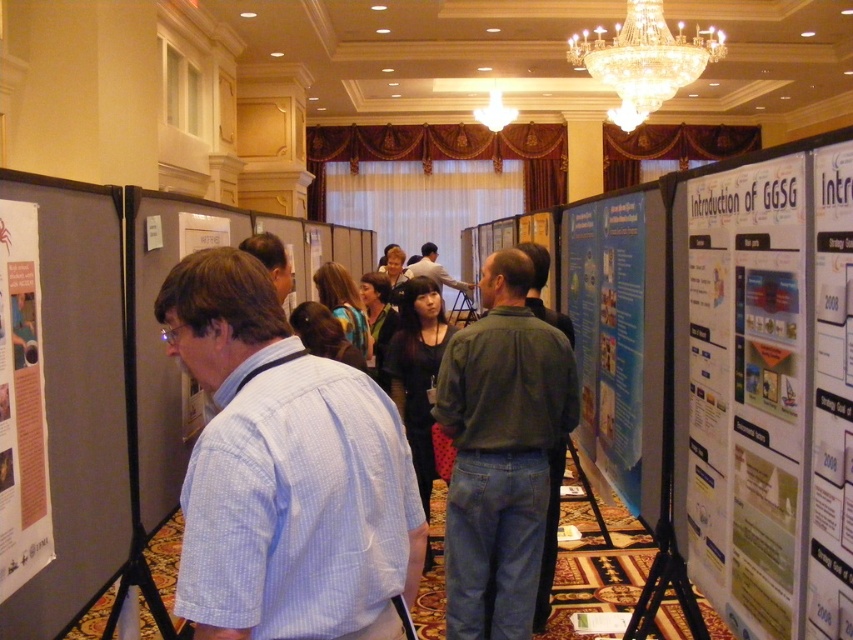
Question: Does light blue shirt at center appear over dark gray shirt at center?

Choices:
 (A) no
 (B) yes

Answer: (A)

Question: Which point is closer to the camera?

Choices:
 (A) dark gray shirt at center
 (B) light blue shirt at center
 (C) gray matte poster at left

Answer: (B)

Question: In this image, where is gray matte poster at left located relative to dark gray shirt at center?

Choices:
 (A) right
 (B) left

Answer: (B)

Question: Which point is farther to the camera?

Choices:
 (A) matte white poster at center right
 (B) green matte shirt at center

Answer: (B)

Question: Is light blue shirt at center smaller than white paper poster at right?

Choices:
 (A) no
 (B) yes

Answer: (A)

Question: Which object is the closest to the crystal at upper center?

Choices:
 (A) blue paperboard poster at center
 (B) white paper poster at left

Answer: (A)